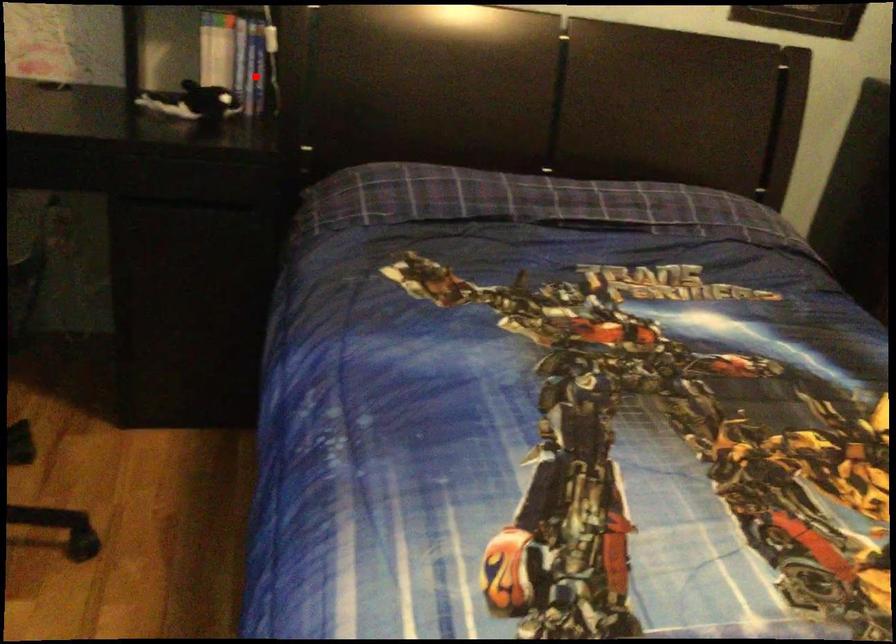
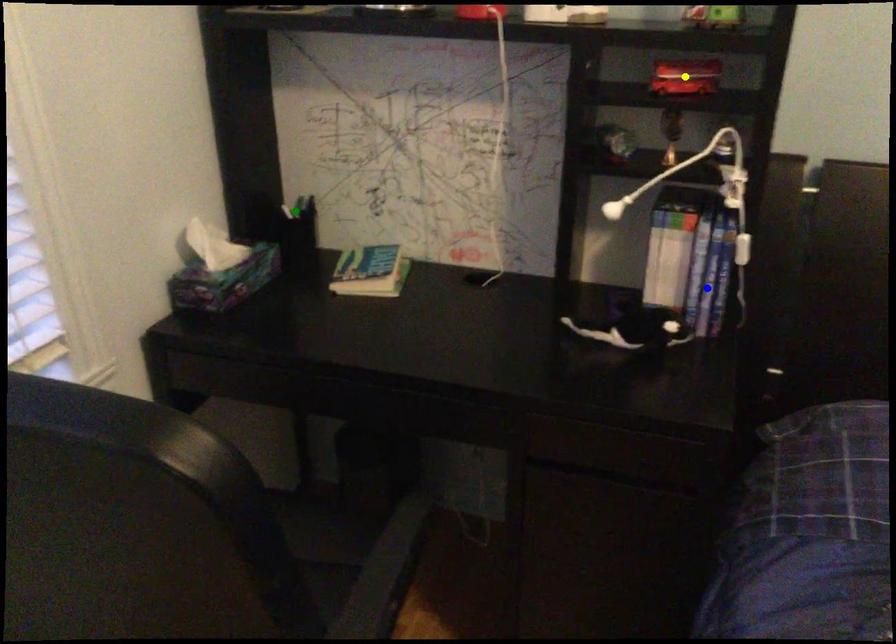
Question: I am providing you with two images of the same scene from different viewpoints. A red point is marked on the first image. You are given multiple points on the second image. Which mark in image 2 goes with the point in image 1?

Choices:
 (A) blue point
 (B) yellow point
 (C) green point

Answer: (A)